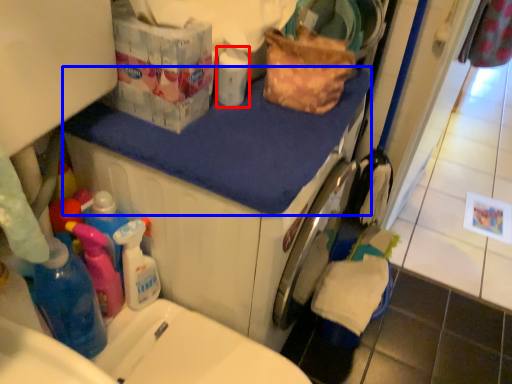
Question: Which point is further to the camera, cleaning product (highlighted by a red box) or counter top (highlighted by a blue box)?

Choices:
 (A) cleaning product
 (B) counter top

Answer: (A)